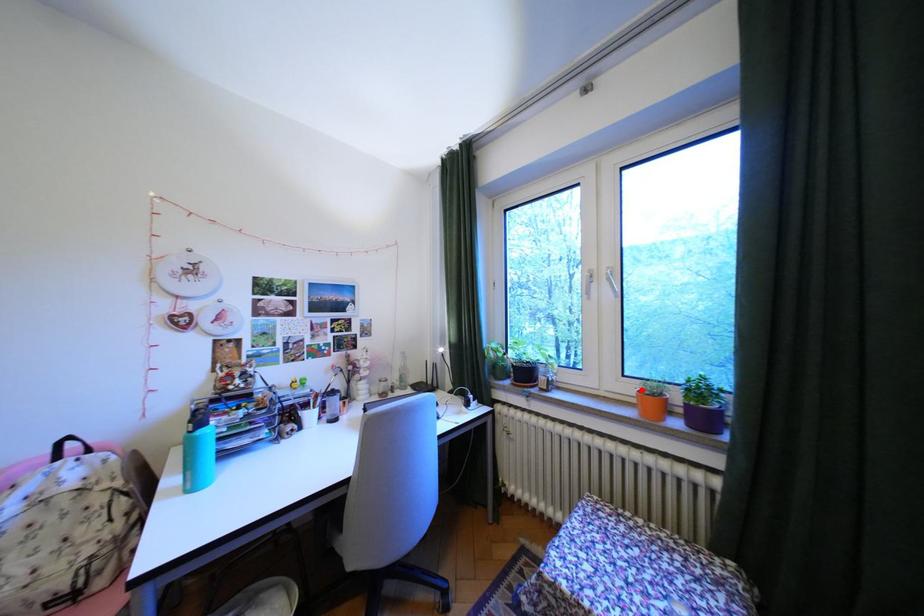
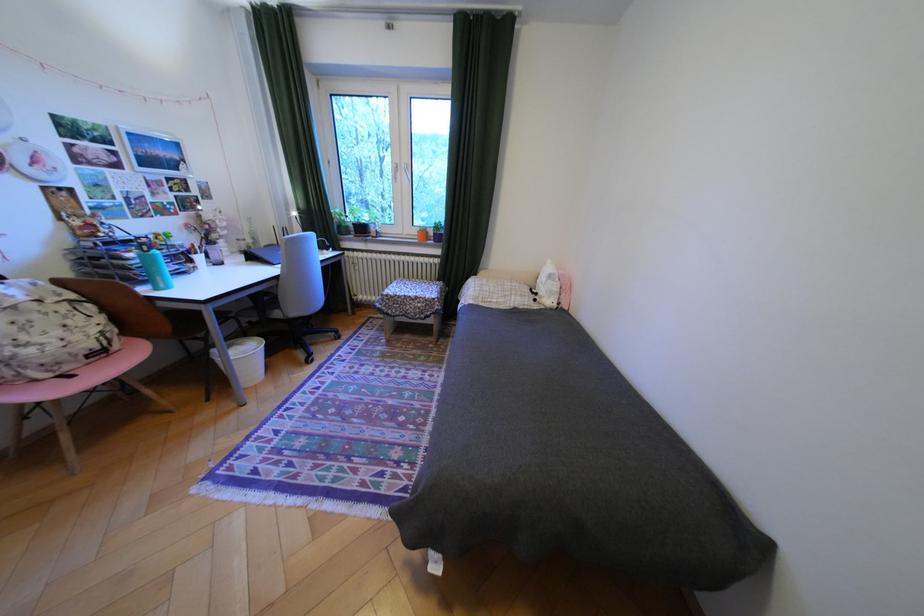
Locate, in the second image, the point that corresponds to the highlighted location in the first image.

(427, 232)